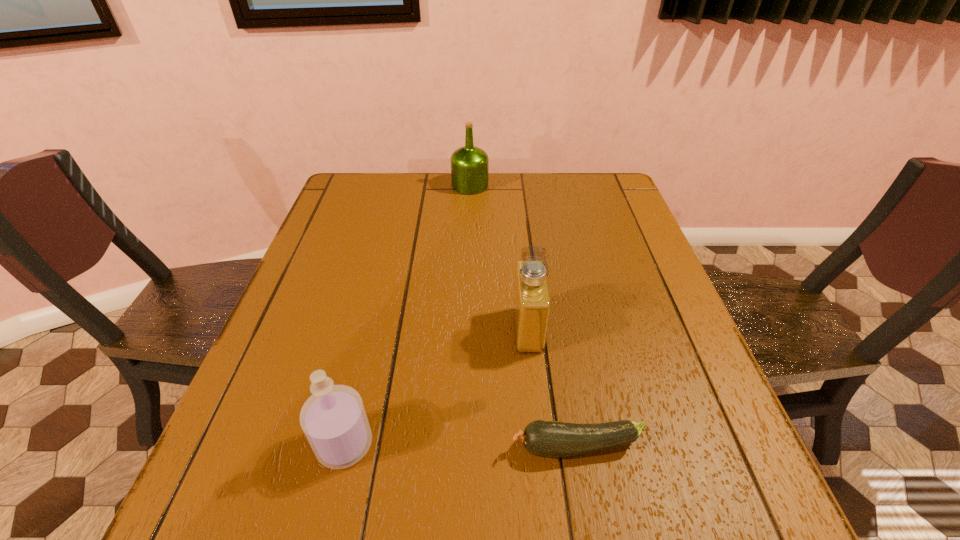
Locate an element on the screen. vacant space located 0.260m on the front-facing side of the right perfume is located at coordinates (393, 330).

Locate an element on the screen. The height and width of the screenshot is (540, 960). vacant space located on the back of the left perfume is located at coordinates (370, 341).

Find the location of `vacant space located at the blossom end of the zucchini`. vacant space located at the blossom end of the zucchini is located at coordinates (475, 447).

Where is `vacant space located 0.190m at the blossom end of the zucchini`? The image size is (960, 540). vacant space located 0.190m at the blossom end of the zucchini is located at coordinates (399, 447).

Where is `vacant region located 0.070m at the blossom end of the zucchini`? This screenshot has width=960, height=540. vacant region located 0.070m at the blossom end of the zucchini is located at coordinates (469, 447).

This screenshot has height=540, width=960. I want to click on object present at the far edge, so click(x=469, y=165).

Find the location of a particular element. This screenshot has height=540, width=960. object present at the left edge is located at coordinates (333, 419).

Where is `vacant space at the far edge`? This screenshot has height=540, width=960. vacant space at the far edge is located at coordinates (391, 202).

This screenshot has width=960, height=540. What are the coordinates of `vacant area at the near edge` in the screenshot? It's located at (477, 531).

At what (x,y) coordinates should I click in order to perform the action: click on vacant space at the left edge of the desktop. Please return your answer as a coordinate pair (x, y). Looking at the image, I should click on (338, 267).